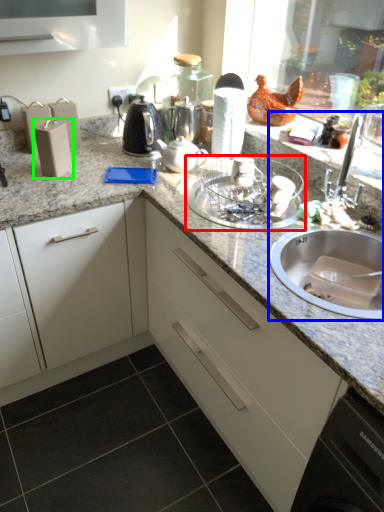
Question: Which object is the closest to the glass bowl (highlighted by a red box)? Choose among these: sink (highlighted by a blue box) or appliance (highlighted by a green box).

Choices:
 (A) sink
 (B) appliance

Answer: (A)